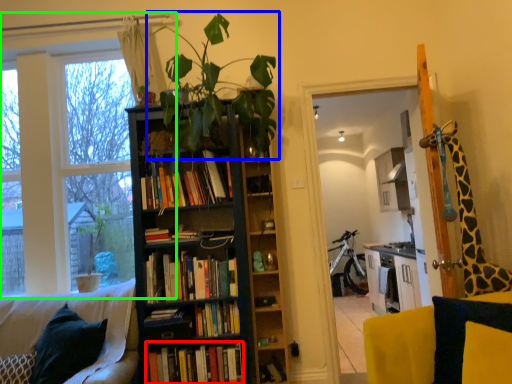
Question: Which object is the farthest from book (highlighted by a red box)? Choose among these: houseplant (highlighted by a blue box) or window frame (highlighted by a green box).

Choices:
 (A) houseplant
 (B) window frame

Answer: (A)